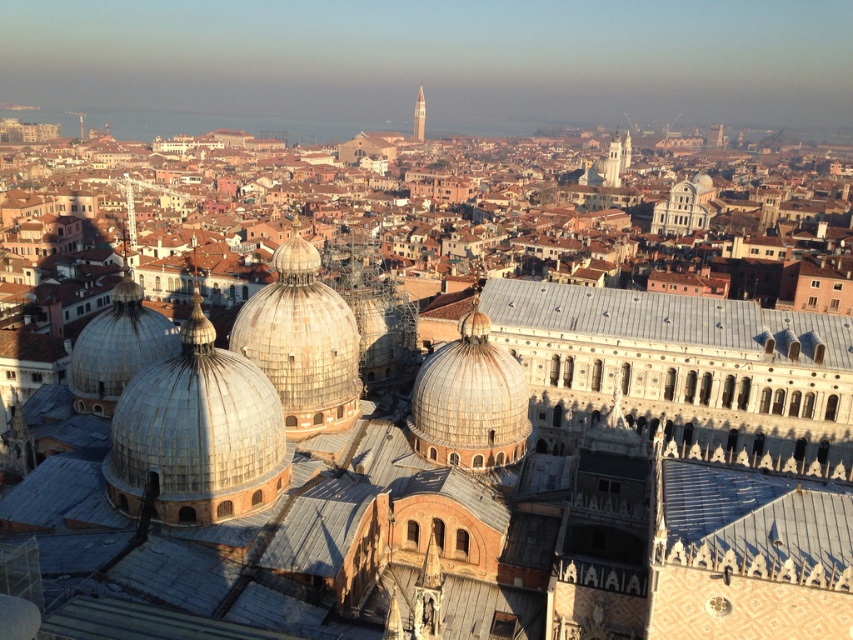
Which is behind, point (193, 406) or point (793, 324)?

Point (793, 324)

Looking at this image, can you confirm if silver metallic domes at center is positioned to the left of gray metallic roof at center?

Correct, you'll find silver metallic domes at center to the left of gray metallic roof at center.

Which is in front, point (253, 500) or point (541, 314)?

Point (253, 500) is in front.

This screenshot has height=640, width=853. I want to click on silver metallic domes at center, so coord(196,433).

Between gray metallic roof at center and silver metallic dome at center, which one has less height?

Standing shorter between the two is gray metallic roof at center.

Does point (689, 330) lie behind point (312, 301)?

Yes, it is.

Find the location of a particular element. The height and width of the screenshot is (640, 853). gray metallic roof at center is located at coordinates (651, 316).

Is point (815, 320) positioned before point (525, 448)?

No, it is not.

What do you see at coordinates (651, 316) in the screenshot?
I see `gray metallic roof at center` at bounding box center [651, 316].

Is point (535, 326) positioned in front of point (456, 385)?

No, it is not.

You are a GUI agent. You are given a task and a screenshot of the screen. Output one action in this format:
    pyautogui.click(x=<x>, y=<y>)
    Task: Click on the gray metallic roof at center
    The image size is (853, 640).
    Given the screenshot: What is the action you would take?
    [651, 316]